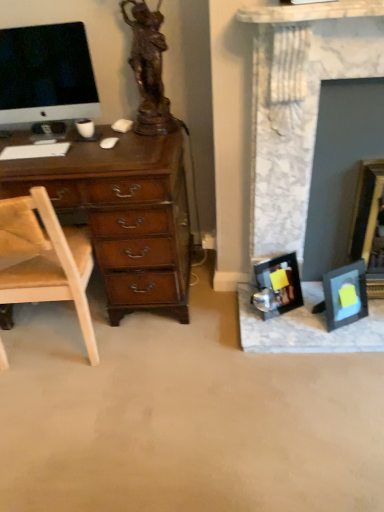
Question: Are white matte computer mouse at center-left and bronze statue at upper left located far from each other?

Choices:
 (A) no
 (B) yes

Answer: (A)

Question: Is bronze statue at upper left completely or partially inside white matte computer mouse at center-left?

Choices:
 (A) no
 (B) yes

Answer: (A)

Question: Can you confirm if white matte computer mouse at center-left is smaller than bronze statue at upper left?

Choices:
 (A) no
 (B) yes

Answer: (B)

Question: Is white matte computer mouse at center-left to the left of bronze statue at upper left from the viewer's perspective?

Choices:
 (A) no
 (B) yes

Answer: (B)

Question: Does white matte computer mouse at center-left have a greater width compared to bronze statue at upper left?

Choices:
 (A) no
 (B) yes

Answer: (A)

Question: Can you confirm if white matte computer mouse at center-left is taller than bronze statue at upper left?

Choices:
 (A) yes
 (B) no

Answer: (B)

Question: From the image's perspective, is marble fireplace at right beneath tan leather chair at left?

Choices:
 (A) no
 (B) yes

Answer: (A)

Question: Would you say marble fireplace at right is outside tan leather chair at left?

Choices:
 (A) no
 (B) yes

Answer: (B)

Question: From a real-world perspective, is marble fireplace at right located higher than tan leather chair at left?

Choices:
 (A) no
 (B) yes

Answer: (B)

Question: Would you say marble fireplace at right is a long distance from tan leather chair at left?

Choices:
 (A) yes
 (B) no

Answer: (B)

Question: Is marble fireplace at right in front of tan leather chair at left?

Choices:
 (A) no
 (B) yes

Answer: (A)

Question: Can you confirm if marble fireplace at right is shorter than tan leather chair at left?

Choices:
 (A) no
 (B) yes

Answer: (A)

Question: Is white matte keyboard at left positioned with its back to marble fireplace at right?

Choices:
 (A) no
 (B) yes

Answer: (A)